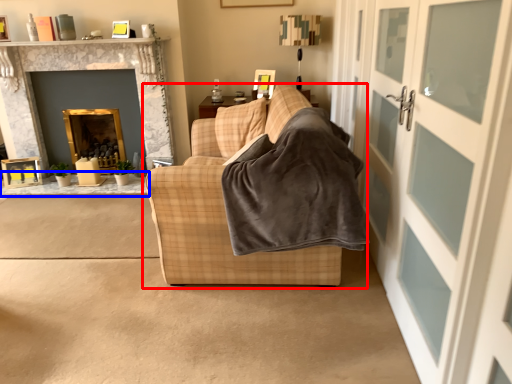
Question: Which point is further to the camera, studio couch (highlighted by a red box) or table (highlighted by a blue box)?

Choices:
 (A) studio couch
 (B) table

Answer: (B)